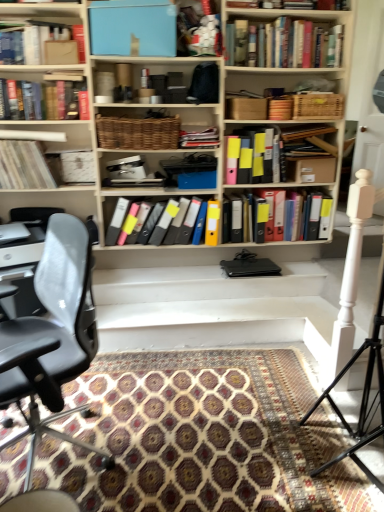
Where is `free spot to the right of black leather chair at left`? The height and width of the screenshot is (512, 384). free spot to the right of black leather chair at left is located at coordinates (171, 449).